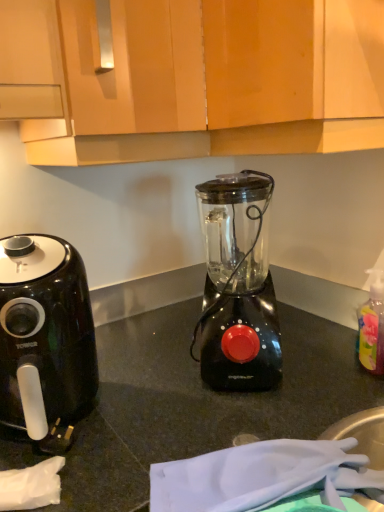
At what (x,y) coordinates should I click in order to perform the action: click on black plastic air fryer at left. Please return your answer as a coordinate pair (x, y). Looking at the image, I should click on (45, 339).

At what (x,y) coordinates should I click in order to perform the action: click on black plastic air fryer at left. Please return your answer as a coordinate pair (x, y). This screenshot has height=512, width=384. Looking at the image, I should click on (45, 339).

Is translucent plastic bottle at right located within wooden cabinet at upper center?

No.

Is wooden cabinet at upper center looking in the opposite direction of translucent plastic bottle at right?

wooden cabinet at upper center is not turned away from translucent plastic bottle at right.

In the image, is wooden cabinet at upper center on the left side or the right side of translucent plastic bottle at right?

In the image, wooden cabinet at upper center appears on the left side of translucent plastic bottle at right.

Who is shorter, wooden cabinet at upper center or translucent plastic bottle at right?

translucent plastic bottle at right.

Considering the positions of objects wooden cabinet at upper center and black plastic air fryer at left in the image provided, who is in front, wooden cabinet at upper center or black plastic air fryer at left?

wooden cabinet at upper center is closer to the camera.

Which object is thinner, wooden cabinet at upper center or black plastic air fryer at left?

With smaller width is black plastic air fryer at left.

Looking at this image, is wooden cabinet at upper center positioned far away from black plastic air fryer at left?

No, wooden cabinet at upper center is not far from black plastic air fryer at left.

How many degrees apart are the facing directions of wooden cabinet at upper center and black plastic air fryer at left?

The angle between the facing direction of wooden cabinet at upper center and the facing direction of black plastic air fryer at left is 70.9 degrees.

From the image's perspective, which one is positioned lower, black plastic air fryer at left or translucent plastic bottle at right?

black plastic air fryer at left is shown below in the image.

From a real-world perspective, who is located lower, black plastic air fryer at left or translucent plastic bottle at right?

From a 3D spatial view, translucent plastic bottle at right is below.

Is black plastic air fryer at left not near translucent plastic bottle at right?

No.

Based on the photo, considering the relative sizes of black plastic air fryer at left and translucent plastic bottle at right in the image provided, is black plastic air fryer at left thinner than translucent plastic bottle at right?

In fact, black plastic air fryer at left might be wider than translucent plastic bottle at right.

Consider the image. Which object is wider, black plastic air fryer at left or wooden cabinet at upper center?

wooden cabinet at upper center is wider.

Does point (70, 272) lie behind point (62, 30)?

Yes, point (70, 272) is behind point (62, 30).

Is black plastic air fryer at left positioned with its back to wooden cabinet at upper center?

No, black plastic air fryer at left is not facing the opposite direction of wooden cabinet at upper center.

Relative to wooden cabinet at upper center, is black plastic air fryer at left in front or behind?

black plastic air fryer at left is behind wooden cabinet at upper center.

Which is behind, point (366, 358) or point (42, 164)?

Positioned behind is point (42, 164).

Considering the sizes of translucent plastic bottle at right and wooden cabinet at upper center in the image, is translucent plastic bottle at right bigger or smaller than wooden cabinet at upper center?

translucent plastic bottle at right is smaller than wooden cabinet at upper center.

Where is `cabinetry on the left of translucent plastic bottle at right`? This screenshot has height=512, width=384. cabinetry on the left of translucent plastic bottle at right is located at coordinates (199, 78).

Consider the image. Is translucent plastic bottle at right at the right side of black plastic air fryer at left?

Yes.

From a real-world perspective, between translucent plastic bottle at right and black plastic air fryer at left, who is vertically lower?

translucent plastic bottle at right, from a real-world perspective.

Can you confirm if translucent plastic bottle at right is wider than black plastic air fryer at left?

No.

Is wooden cabinet at upper center not near black plastic blender at center?

wooden cabinet at upper center is actually quite close to black plastic blender at center.

Considering the sizes of objects wooden cabinet at upper center and black plastic blender at center in the image provided, who is taller, wooden cabinet at upper center or black plastic blender at center?

Answer: wooden cabinet at upper center.

Which is behind, wooden cabinet at upper center or black plastic blender at center?

black plastic blender at center is behind.

At what (x,y) coordinates should I click in order to perform the action: click on blender on the right of wooden cabinet at upper center. Please return your answer as a coordinate pair (x, y). The height and width of the screenshot is (512, 384). Looking at the image, I should click on (238, 285).

This screenshot has width=384, height=512. Find the location of `bottle below the wooden cabinet at upper center (from the image's perspective)`. bottle below the wooden cabinet at upper center (from the image's perspective) is located at coordinates (372, 325).

At what (x,y) coordinates should I click in order to perform the action: click on coffee maker behind the wooden cabinet at upper center. Please return your answer as a coordinate pair (x, y). The image size is (384, 512). Looking at the image, I should click on (45, 339).

Considering their positions, is wooden cabinet at upper center positioned further to black plastic blender at center than black plastic air fryer at left?

black plastic air fryer at left is positioned further to the anchor black plastic blender at center.

Based on their spatial positions, is translucent plastic bottle at right or wooden cabinet at upper center further from black plastic blender at center?

Among the two, translucent plastic bottle at right is located further to black plastic blender at center.

From the image, which object appears to be farther from translucent plastic bottle at right, black plastic blender at center or black plastic air fryer at left?

Based on the image, black plastic air fryer at left appears to be further to translucent plastic bottle at right.

Estimate the real-world distances between objects in this image. Which object is further from black plastic air fryer at left, black plastic blender at center or translucent plastic bottle at right?

translucent plastic bottle at right.

Estimate the real-world distances between objects in this image. Which object is closer to wooden cabinet at upper center, black plastic air fryer at left or black plastic blender at center?

Among the two, black plastic blender at center is located nearer to wooden cabinet at upper center.

Looking at the image, which one is located further to wooden cabinet at upper center, black plastic blender at center or translucent plastic bottle at right?

translucent plastic bottle at right is further to wooden cabinet at upper center.

Based on their spatial positions, is wooden cabinet at upper center or translucent plastic bottle at right closer to black plastic blender at center?

wooden cabinet at upper center lies closer to black plastic blender at center than the other object.

When comparing their distances from translucent plastic bottle at right, does black plastic blender at center or wooden cabinet at upper center seem closer?

black plastic blender at center is closer to translucent plastic bottle at right.

Locate an element on the screen. Image resolution: width=384 pixels, height=512 pixels. blender between wooden cabinet at upper center and translucent plastic bottle at right in the up-down direction is located at coordinates (238, 285).

Identify the location of blender between wooden cabinet at upper center and black plastic air fryer at left from top to bottom. (238, 285).

Image resolution: width=384 pixels, height=512 pixels. Identify the location of blender between black plastic air fryer at left and translucent plastic bottle at right from left to right. (238, 285).

The height and width of the screenshot is (512, 384). I want to click on cabinetry between black plastic air fryer at left and translucent plastic bottle at right from left to right, so click(x=199, y=78).